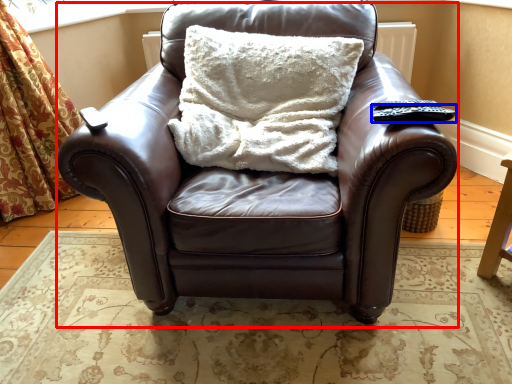
Question: Which object appears farthest to the camera in this image, chair (highlighted by a red box) or remote (highlighted by a blue box)?

Choices:
 (A) chair
 (B) remote

Answer: (B)